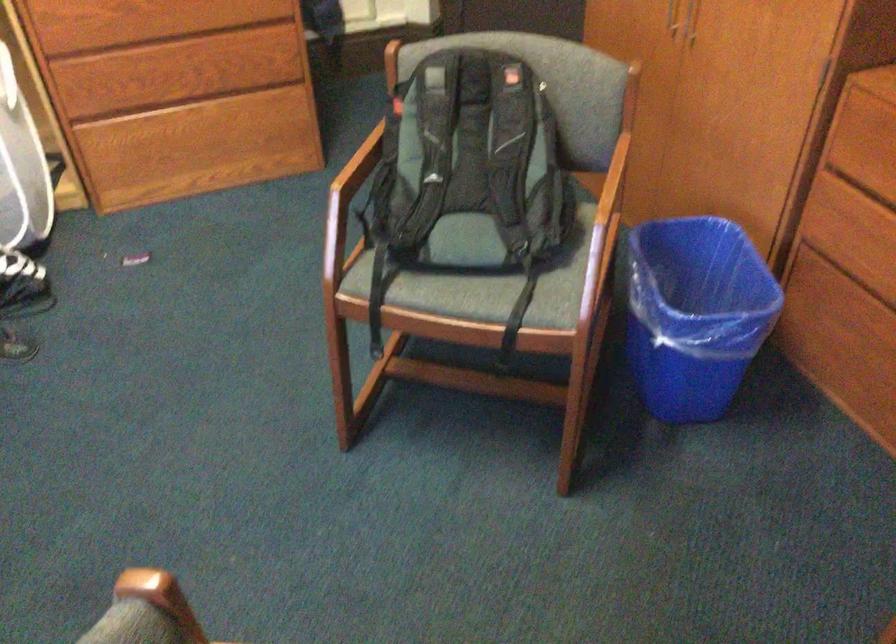
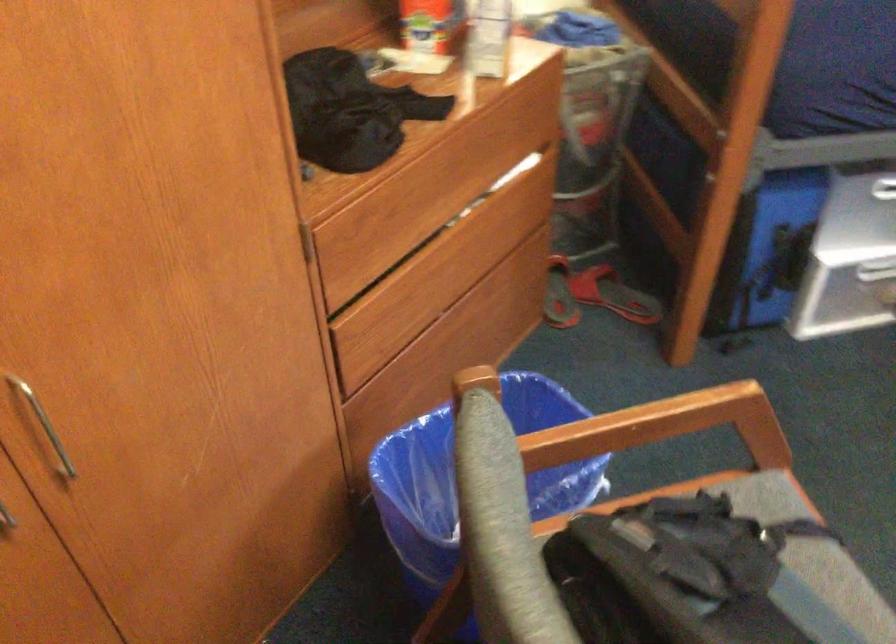
Find the pixel in the second image that matches [569,328] in the first image.

(769, 504)